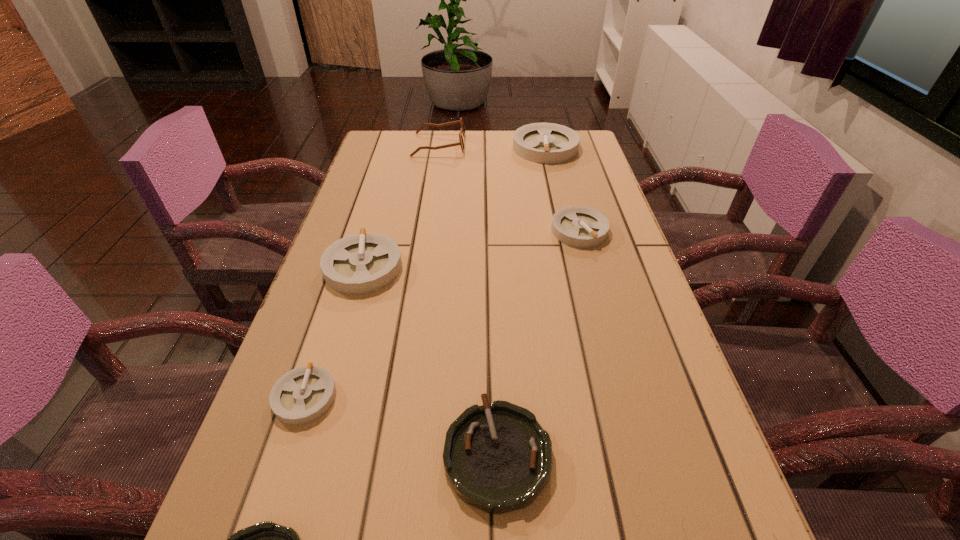
Locate an element on the screen. This screenshot has width=960, height=540. spectacles is located at coordinates click(462, 131).

I want to click on the biggest gray ashtray, so click(548, 143).

The width and height of the screenshot is (960, 540). I want to click on the sixth shortest object, so 548,143.

The height and width of the screenshot is (540, 960). I want to click on the third tallest object, so click(x=361, y=263).

Locate an element on the screen. the third smallest gray ashtray is located at coordinates (361, 263).

You are a GUI agent. You are given a task and a screenshot of the screen. Output one action in this format:
    pyautogui.click(x=<x>, y=<y>)
    Task: Click on the fourth tallest object
    
    Given the screenshot: What is the action you would take?
    pyautogui.click(x=578, y=226)

This screenshot has width=960, height=540. What are the coordinates of `the fourth shortest ashtray` in the screenshot? It's located at (578, 226).

In order to click on the bigger green ashtray in this screenshot , I will do pyautogui.click(x=497, y=457).

Find the location of a particular element. The image size is (960, 540). the farther green ashtray is located at coordinates (497, 457).

Identify the location of the nearest gray ashtray. This screenshot has width=960, height=540. (302, 395).